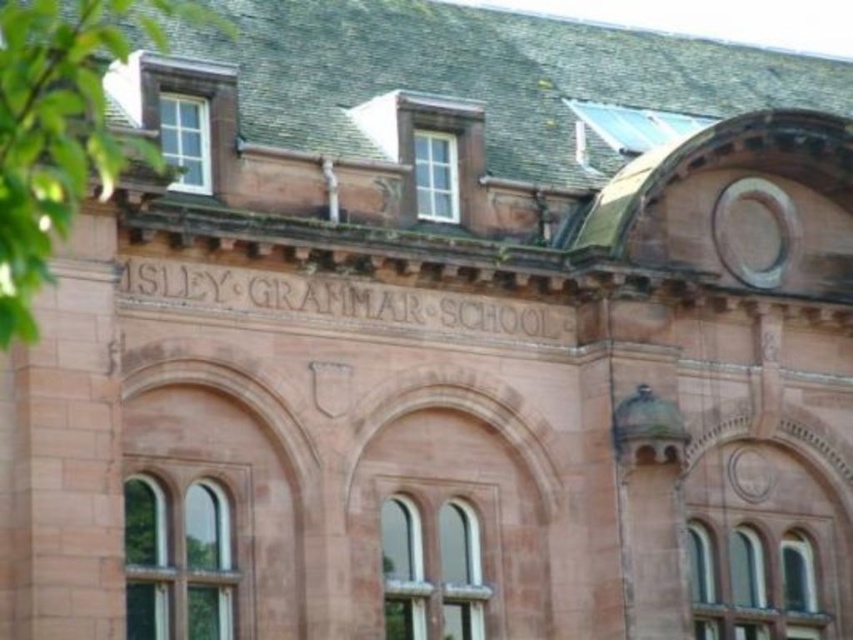
You are a visitor approaching the ISLEY GRAMMAR SCHOOL building and see the green leafy tree at left and the brown stone engraving at center. Which object is located more to the left?

The green leafy tree at left is positioned on the left side of brown stone engraving at center, so it is more to the left.

You are standing in front of the ISLEY GRAMMAR SCHOOL building. There are two points marked on the building facade. One is at coordinate point (80, 65) and the other is at point (436, 330). Which point is closer to you as you face the building?

Point (80, 65) is in front of point (436, 330), so it is closer to you when facing the building.